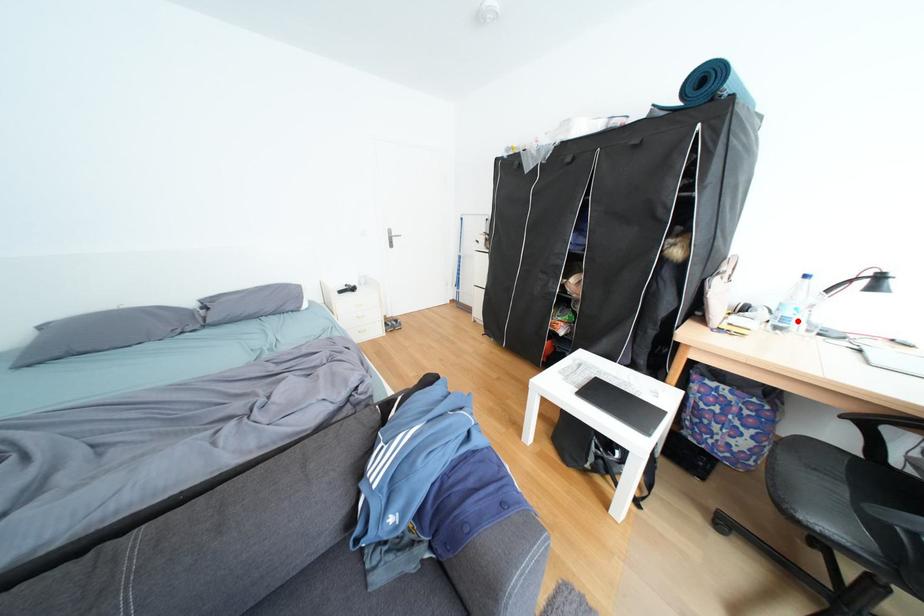
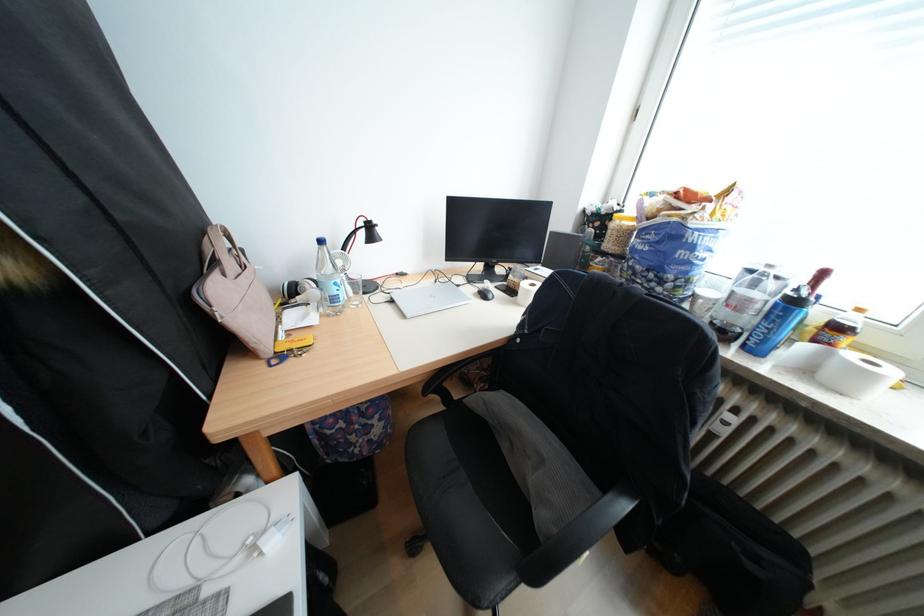
In the second image, find the point that corresponds to the highlighted location in the first image.

(346, 300)